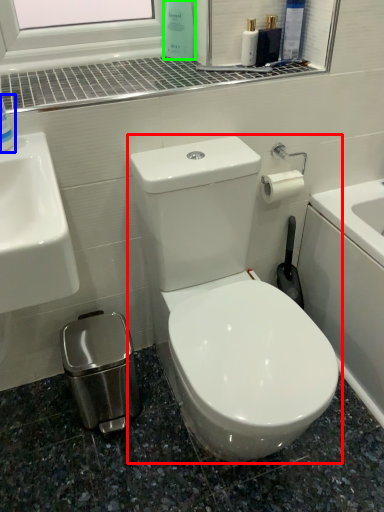
Question: Which is farther away from toilet (highlighted by a red box)? cleaning product (highlighted by a blue box) or cleaning product (highlighted by a green box)?

Choices:
 (A) cleaning product
 (B) cleaning product

Answer: (B)